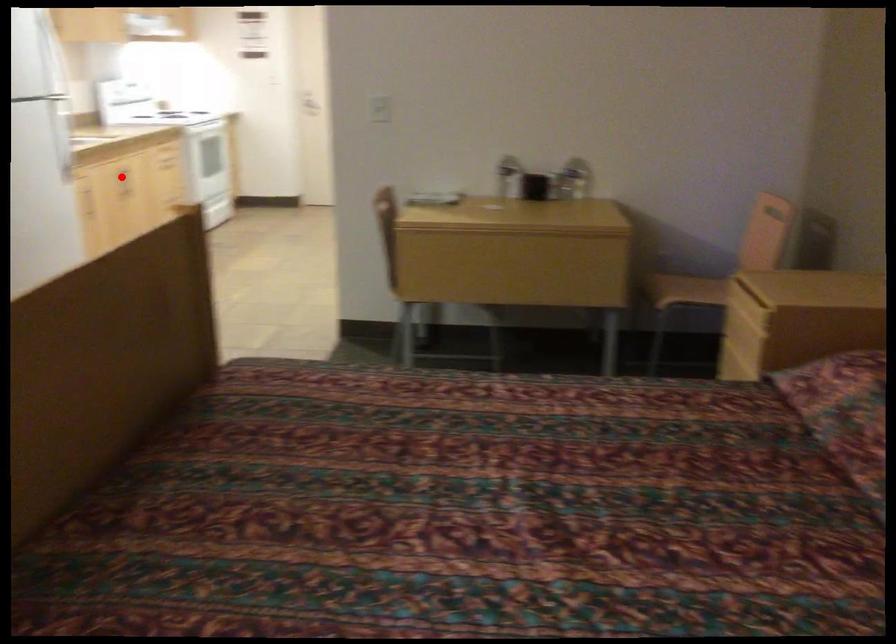
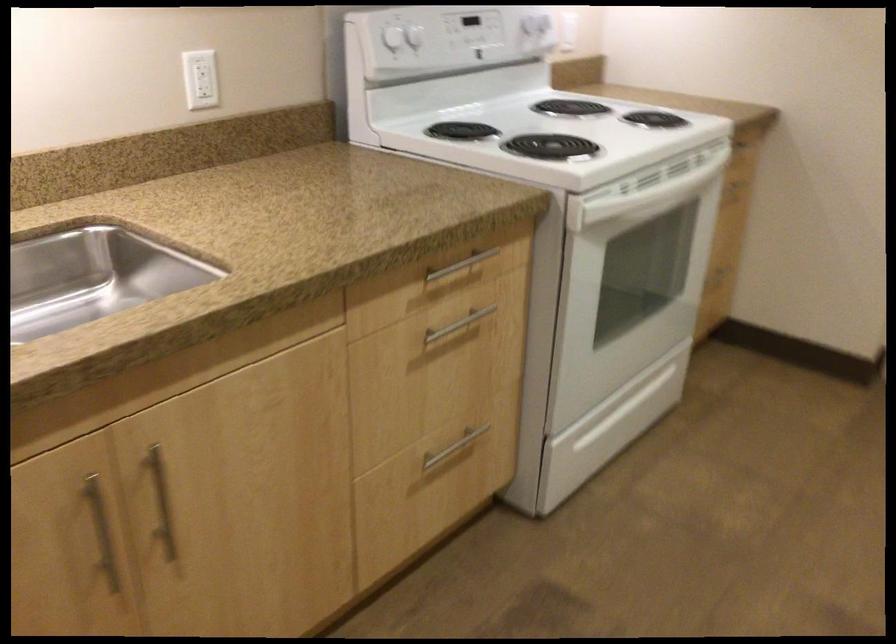
The point at the highlighted location is marked in the first image. Where is the corresponding point in the second image?

(101, 532)